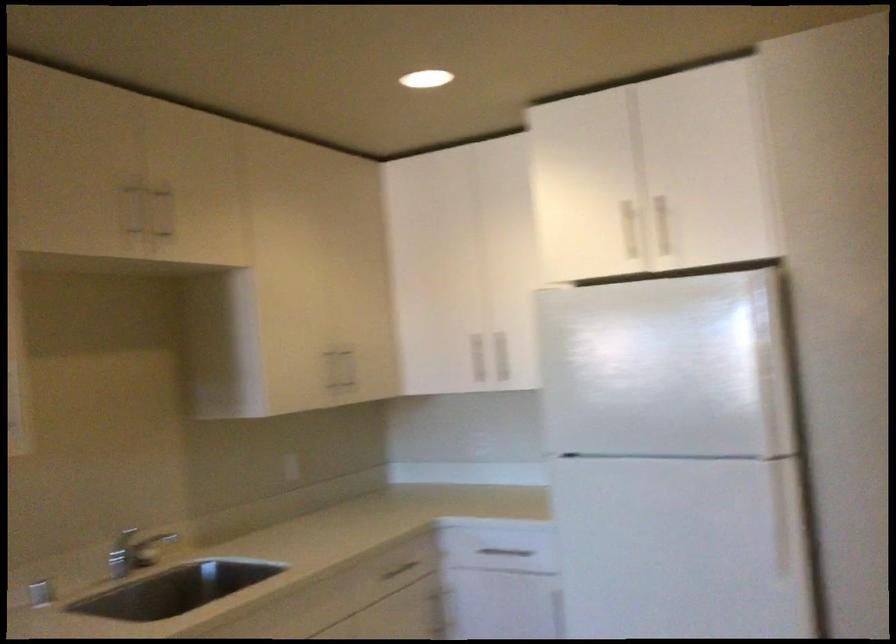
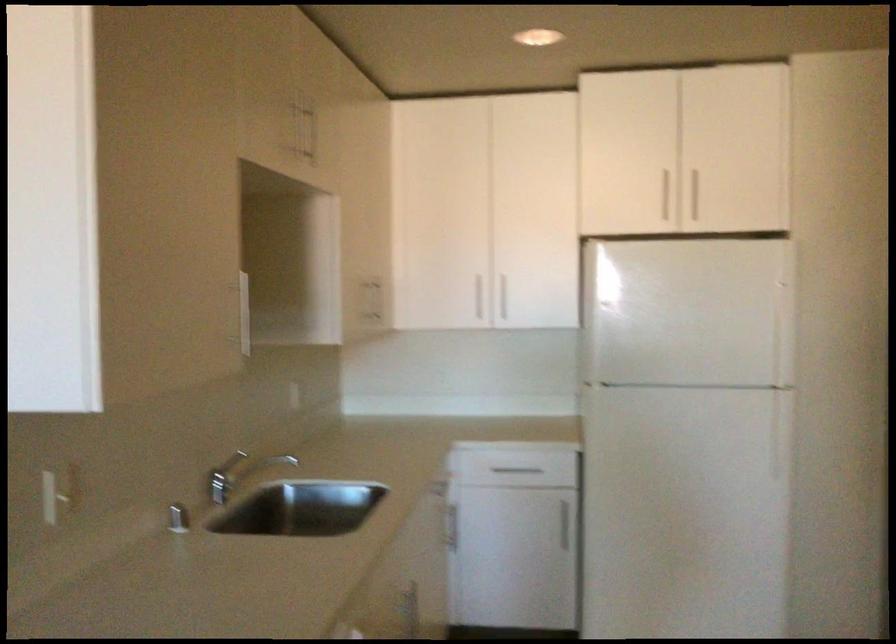
Locate, in the second image, the point that corresponds to point 616,227 in the first image.

(661, 194)